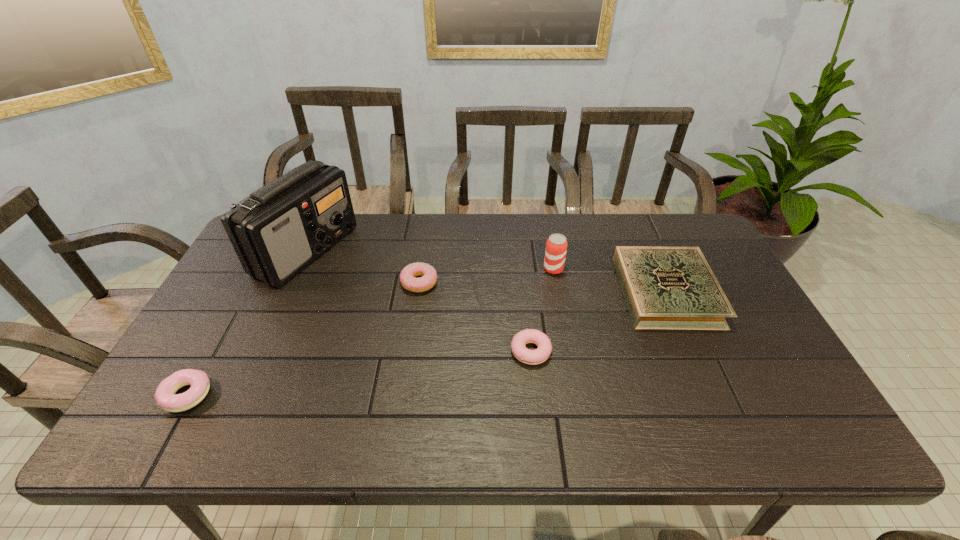
You are a GUI agent. You are given a task and a screenshot of the screen. Output one action in this format:
    pyautogui.click(x=<x>, y=<y>)
    Task: Click on the free space located on the front panel of the tallest object
    Image resolution: width=960 pixels, height=540 pixels.
    Given the screenshot: What is the action you would take?
    pyautogui.click(x=448, y=251)

The height and width of the screenshot is (540, 960). I want to click on vacant region located 0.190m on the right of the fifth shortest object, so click(x=625, y=269).

The image size is (960, 540). Identify the location of vacant area situated 0.120m on the back of the hardback book. (642, 235).

At what (x,y) coordinates should I click in order to perform the action: click on vacant space located 0.180m on the front of the third object from left to right. Please return your answer as a coordinate pair (x, y). This screenshot has height=540, width=960. Looking at the image, I should click on (411, 345).

I want to click on vacant space located 0.140m on the right of the nearest doughnut, so click(x=270, y=395).

Identify the location of free space located on the back of the rightmost doughnut. This screenshot has height=540, width=960. (519, 241).

Where is `object present at the far edge`? This screenshot has height=540, width=960. object present at the far edge is located at coordinates (277, 231).

Locate an element on the screen. This screenshot has height=540, width=960. object that is at the near edge is located at coordinates (165, 396).

The image size is (960, 540). In order to click on radio receiver that is at the left edge in this screenshot , I will do `click(277, 231)`.

Locate an element on the screen. This screenshot has height=540, width=960. doughnut that is at the left edge is located at coordinates (165, 396).